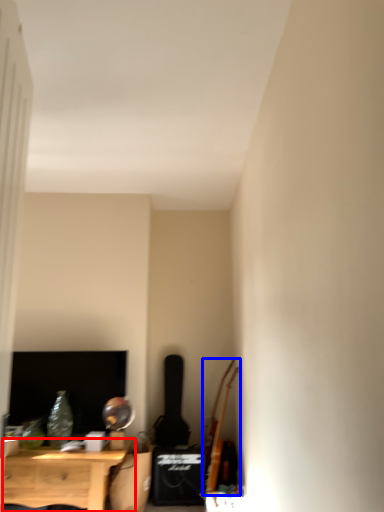
Question: Which point is further to the camera, nightstand (highlighted by a red box) or instrument (highlighted by a blue box)?

Choices:
 (A) nightstand
 (B) instrument

Answer: (B)